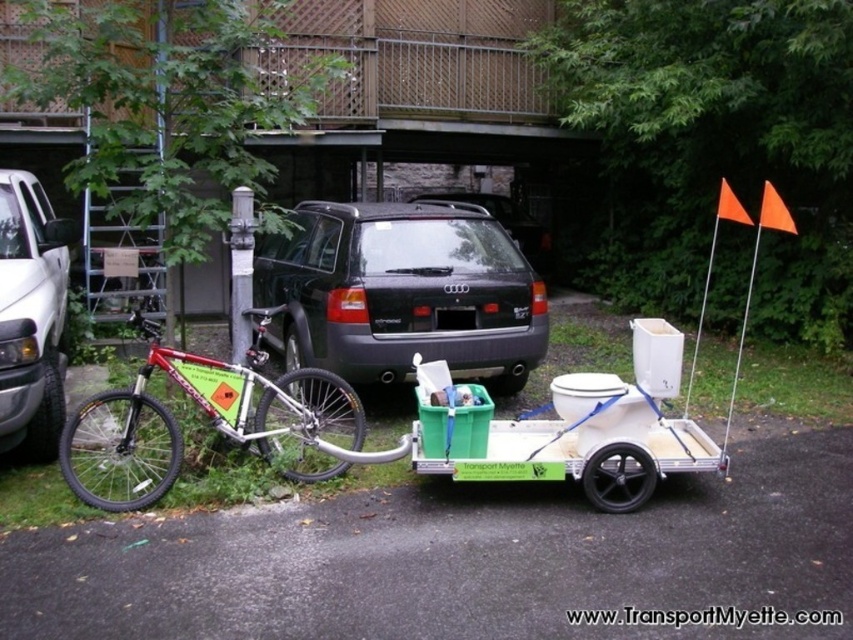
You are a delivery person who needs to load a package into your vehicle. You have a choice between the black matte suv at center and the shiny metallic bicycle at left. Which vehicle has more space to carry the package?

The black matte suv at center is bigger than the shiny metallic bicycle at left, so it has more space to carry the package.

You are a delivery person needing to park your vehicle between the black matte suv at center and the white matte truck at left. Based on their positions, which side should you park on to ensure you are between them?

Since the black matte suv at center is located above the white matte truck at left, you should park below the black matte suv at center and above the white matte truck at left to be between them.

Where is the black matte suv at center located in the image?

The black matte suv at center is located at point 0.459 on the x axis and 0.472 on the y axis.